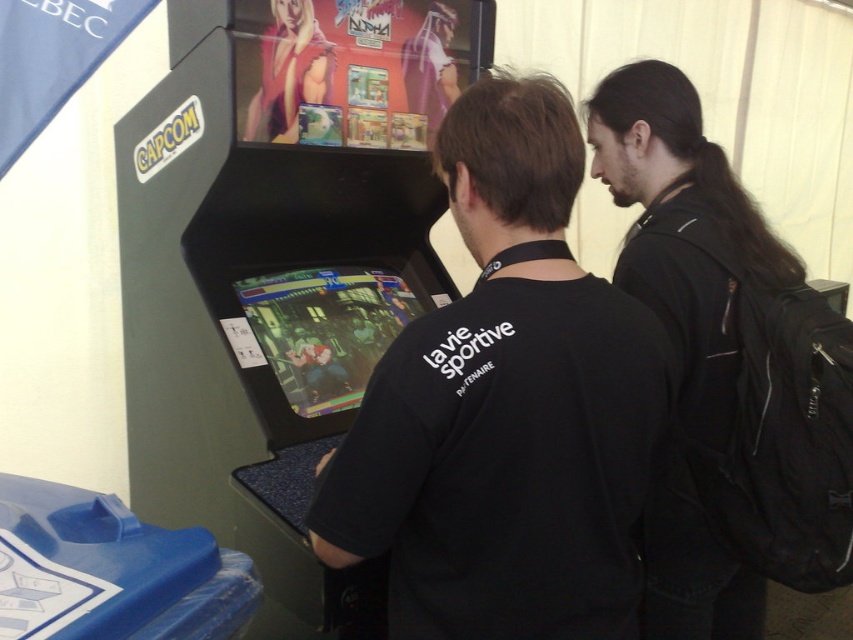
Is black matte shirt at center bigger than black leather jacket at upper right?

No, black matte shirt at center is not bigger than black leather jacket at upper right.

Can you confirm if black matte shirt at center is positioned above black leather jacket at upper right?

Correct, black matte shirt at center is located above black leather jacket at upper right.

Between point (462, 538) and point (723, 358), which one is positioned behind?

Point (723, 358)

The height and width of the screenshot is (640, 853). In order to click on black matte shirt at center in this screenshot , I will do `click(505, 406)`.